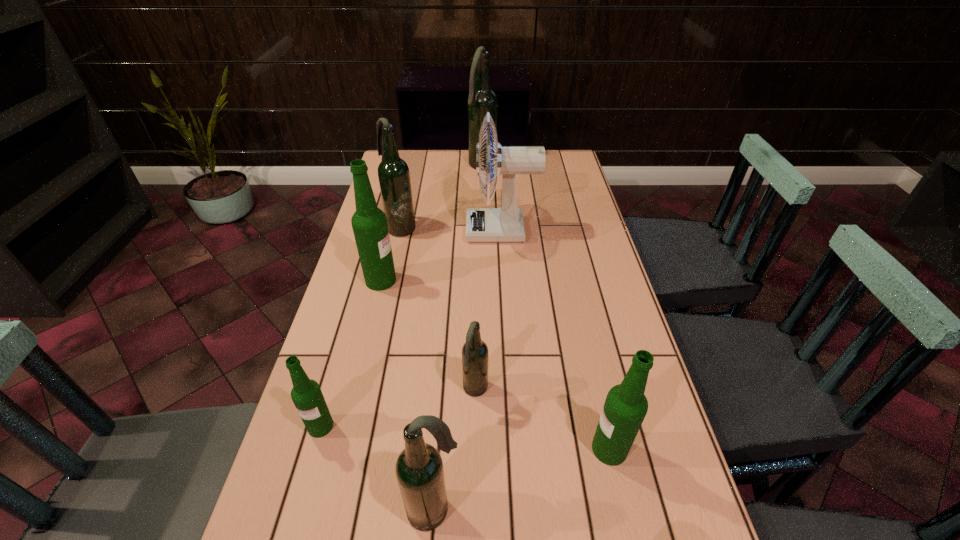
In order to click on free space located on the label of the rightmost green beer bottle in this screenshot , I will do `click(460, 449)`.

You are a GUI agent. You are given a task and a screenshot of the screen. Output one action in this format:
    pyautogui.click(x=<x>, y=<y>)
    Task: Click on the free region located 0.290m on the label of the rightmost green beer bottle
    This screenshot has width=960, height=540.
    Given the screenshot: What is the action you would take?
    click(x=450, y=449)

You are a GUI agent. You are given a task and a screenshot of the screen. Output one action in this format:
    pyautogui.click(x=<x>, y=<y>)
    Task: Click on the vacant space located on the label of the rightmost green beer bottle
    This screenshot has width=960, height=540.
    Given the screenshot: What is the action you would take?
    pyautogui.click(x=514, y=449)

Identify the location of free space located 0.240m on the right of the nearest beer bottle. (590, 510).

You are a GUI agent. You are given a task and a screenshot of the screen. Output one action in this format:
    pyautogui.click(x=<x>, y=<y>)
    Task: Click on the vacant area situated 0.170m on the label of the smallest green beer bottle
    The image size is (960, 540).
    Given the screenshot: What is the action you would take?
    pyautogui.click(x=291, y=527)

At what (x,y) coordinates should I click in order to perform the action: click on vacant region located 0.340m on the right of the fourth nearest object. Please return your answer as a coordinate pair (x, y). The image size is (960, 540). Looking at the image, I should click on (637, 390).

Locate an element on the screen. object at the far edge is located at coordinates (482, 99).

Where is `object at the right edge`? object at the right edge is located at coordinates (625, 407).

Image resolution: width=960 pixels, height=540 pixels. In the image, there is a desktop. Find the location of `free space at the far edge`. free space at the far edge is located at coordinates (444, 157).

Locate an element on the screen. This screenshot has height=540, width=960. vacant space at the left edge of the desktop is located at coordinates (344, 325).